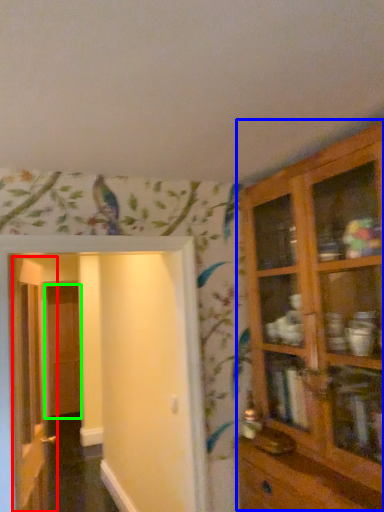
Question: Estimate the real-world distances between objects in this image. Which object is closer to door (highlighted by a red box), cupboard (highlighted by a blue box) or door (highlighted by a green box)?

Choices:
 (A) cupboard
 (B) door

Answer: (A)